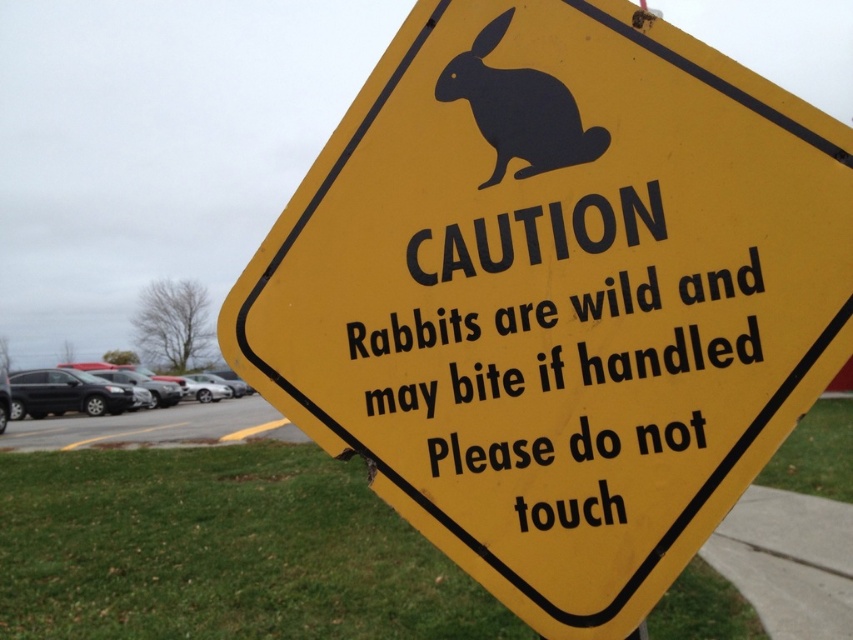
Question: Which of the following is the farthest from the observer?

Choices:
 (A) black matte rabbit at upper center
 (B) yellow plastic sign at center

Answer: (A)

Question: Does yellow plastic sign at center have a smaller size compared to black matte rabbit at upper center?

Choices:
 (A) no
 (B) yes

Answer: (A)

Question: Does yellow plastic sign at center have a lesser width compared to black matte rabbit at upper center?

Choices:
 (A) yes
 (B) no

Answer: (B)

Question: Where is yellow plastic sign at center located in relation to black matte rabbit at upper center in the image?

Choices:
 (A) left
 (B) right

Answer: (A)